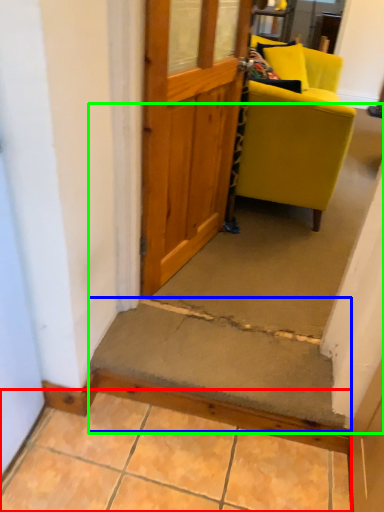
Question: Which is farther away from concrete (highlighted by a red box)? stairwell (highlighted by a blue box) or stairwell (highlighted by a green box)?

Choices:
 (A) stairwell
 (B) stairwell

Answer: (B)